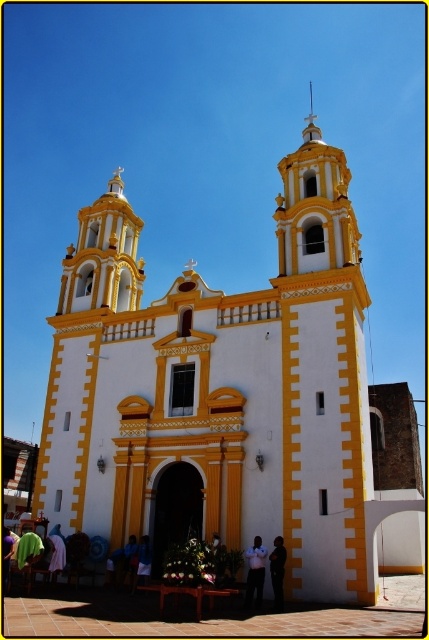
You are standing in a park and see the white painted stone church at center and the dark blue fabric at lower center. Which object is positioned to the left?

The dark blue fabric at lower center is positioned to the left of the white painted stone church at center.

You are a visitor standing in front of the church and notice the white painted stone church at center and the dark blue fabric at lower center. Which object appears bigger in the image?

The white painted stone church at center has a larger size compared to the dark blue fabric at lower center, so the white painted stone church at center appears bigger in the image.